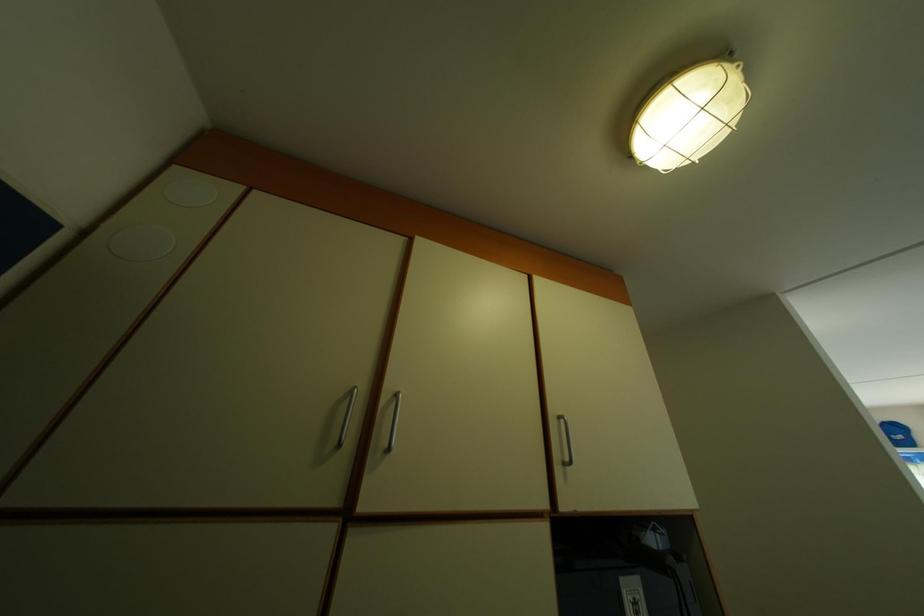
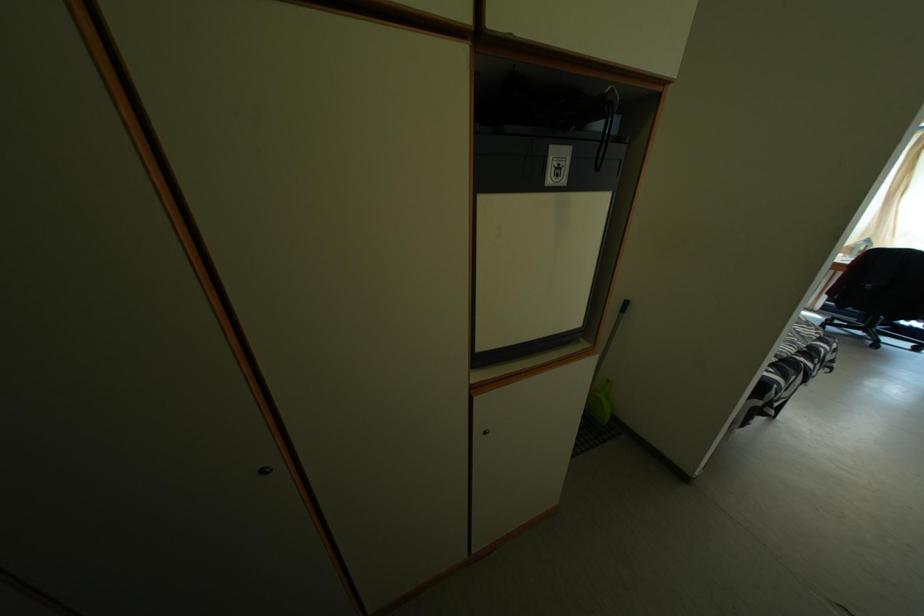
Question: The images are taken continuously from a first-person perspective. In which direction is your viewpoint rotating?

Choices:
 (A) Left
 (B) Right
 (C) Up
 (D) Down

Answer: (D)